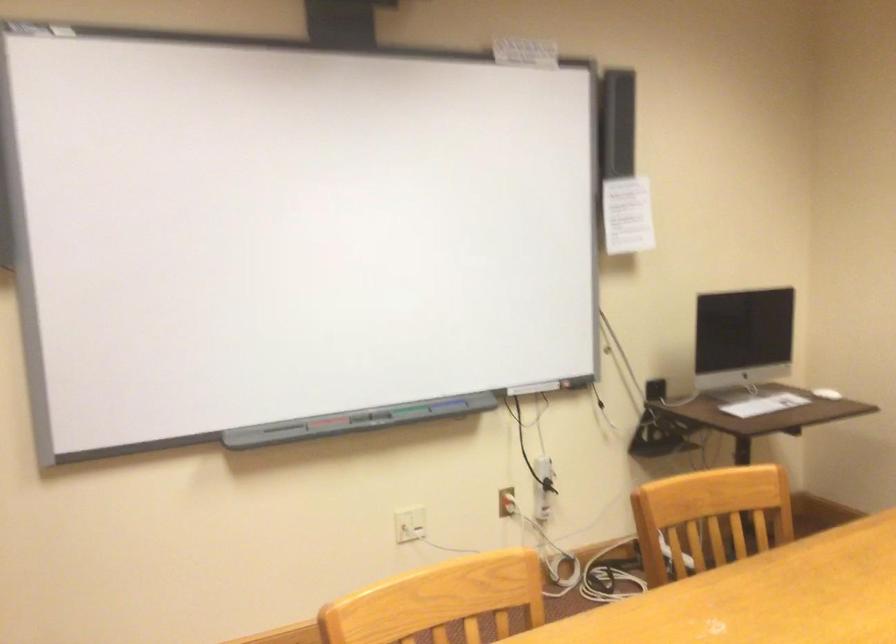
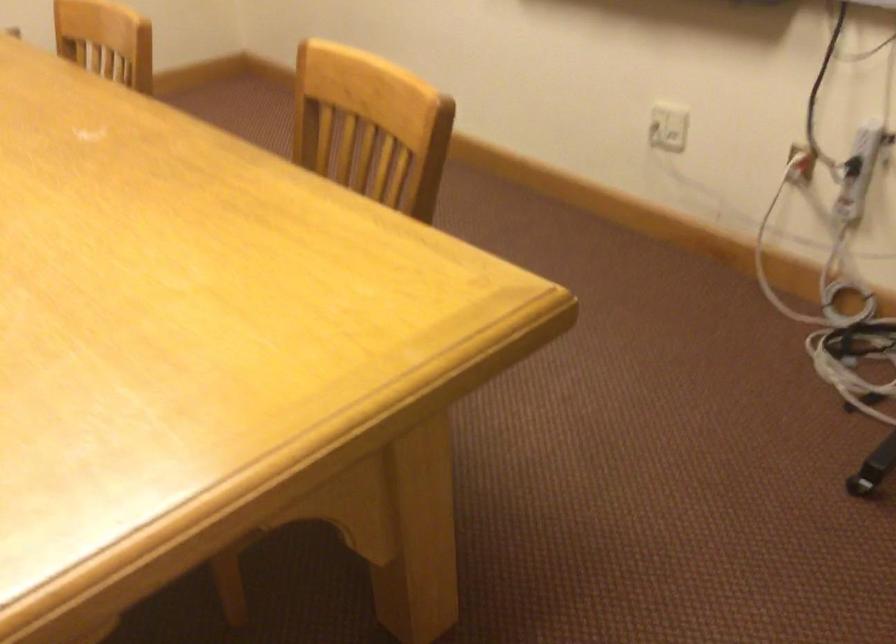
Find the pixel in the second image that matches (411,525) in the first image.

(668, 127)